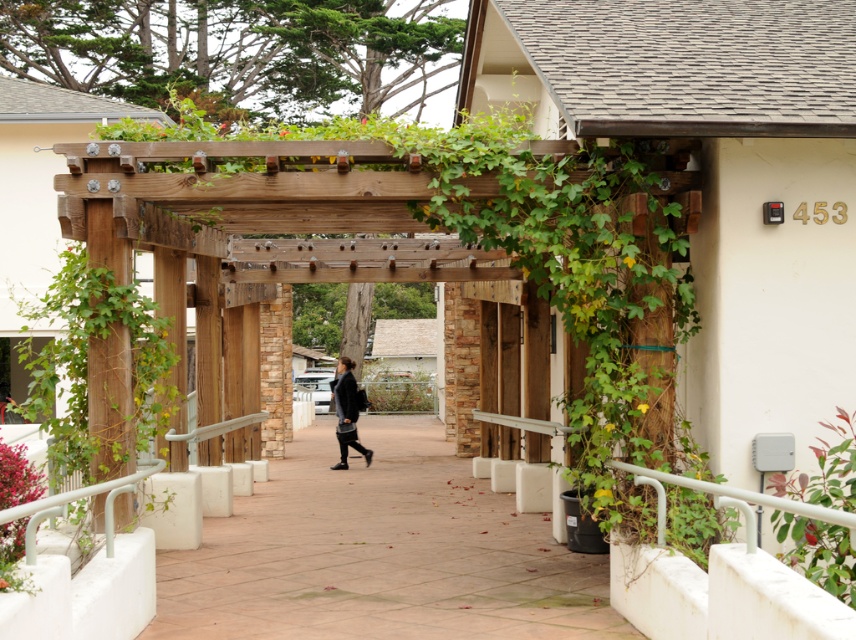
Does green vine at center have a smaller size compared to dark gray fabric jacket at center?

No, green vine at center is not smaller than dark gray fabric jacket at center.

At what (x,y) coordinates should I click in order to perform the action: click on green vine at center. Please return your answer as a coordinate pair (x, y). Looking at the image, I should click on (88, 365).

Based on the photo, can you confirm if paved concrete walkway at center is positioned to the left of dark gray fabric jacket at center?

No, paved concrete walkway at center is not to the left of dark gray fabric jacket at center.

Who is positioned more to the right, paved concrete walkway at center or dark gray fabric jacket at center?

paved concrete walkway at center

At what (x,y) coordinates should I click in order to perform the action: click on paved concrete walkway at center. Please return your answer as a coordinate pair (x, y). This screenshot has height=640, width=856. Looking at the image, I should click on (379, 552).

Which is more to the left, green leafy plant at lower right or dark gray fabric jacket at center?

Positioned to the left is dark gray fabric jacket at center.

Is green leafy plant at lower right wider than dark gray fabric jacket at center?

No, green leafy plant at lower right is not wider than dark gray fabric jacket at center.

Who is more forward, (x=847, y=456) or (x=343, y=410)?

Point (x=847, y=456)

Find the location of a particular element. Image resolution: width=856 pixels, height=640 pixels. green leafy plant at lower right is located at coordinates (818, 552).